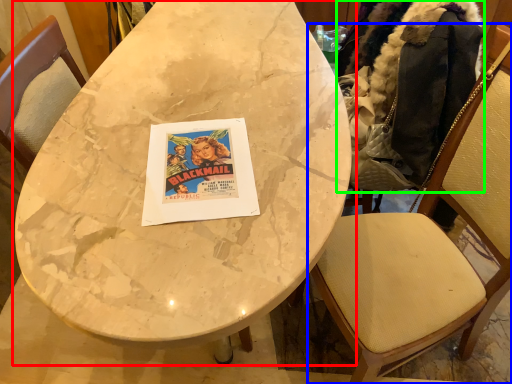
Question: Which object is positioned closest to table (highlighted by a red box)? Select from chair (highlighted by a blue box) and jacket (highlighted by a green box).

Choices:
 (A) chair
 (B) jacket

Answer: (B)